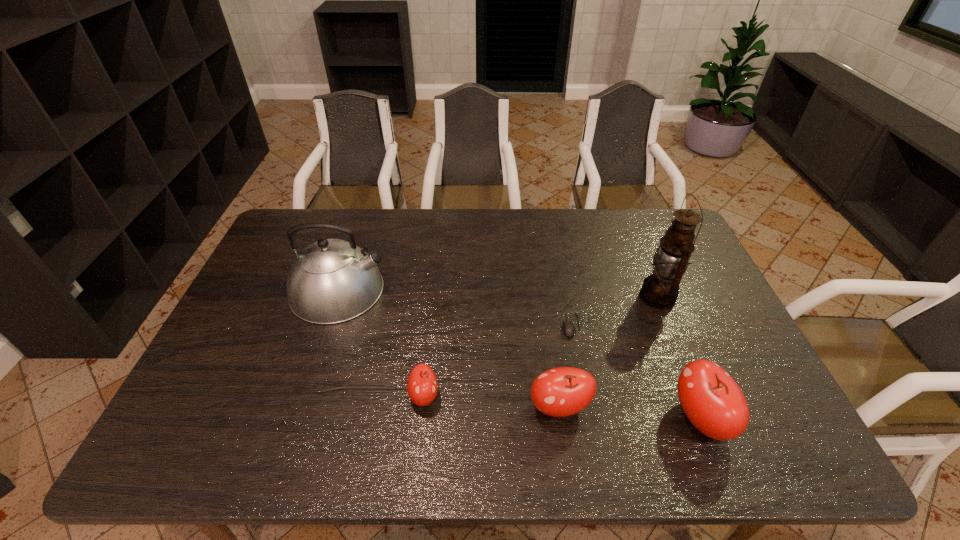
At what (x,y) coordinates should I click in order to perform the action: click on the fifth tallest object. Please return your answer as a coordinate pair (x, y). This screenshot has width=960, height=540. Looking at the image, I should click on (422, 386).

Where is `the leftmost apple`? the leftmost apple is located at coordinates (422, 386).

Locate an element on the screen. the second apple from left to right is located at coordinates (564, 391).

Where is `the third shortest object`? the third shortest object is located at coordinates coord(564,391).

Find the location of `the rightmost apple`. the rightmost apple is located at coordinates (713, 402).

Identify the location of the tallest object. (660, 290).

Locate an element on the screen. This screenshot has height=540, width=960. mouse is located at coordinates (569, 330).

Locate an element on the screen. This screenshot has height=540, width=960. kettle is located at coordinates (331, 281).

Identify the location of the leftmost object. [331, 281].

Locate an element on the screen. The height and width of the screenshot is (540, 960). blank space located 0.200m on the back of the shortest apple is located at coordinates (432, 319).